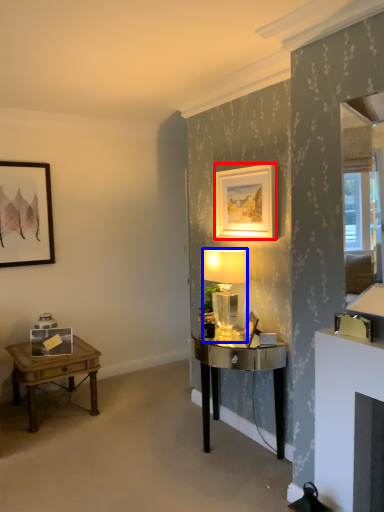
Question: Among these objects, which one is farthest to the camera, picture frame (highlighted by a red box) or lamp (highlighted by a blue box)?

Choices:
 (A) picture frame
 (B) lamp

Answer: (B)